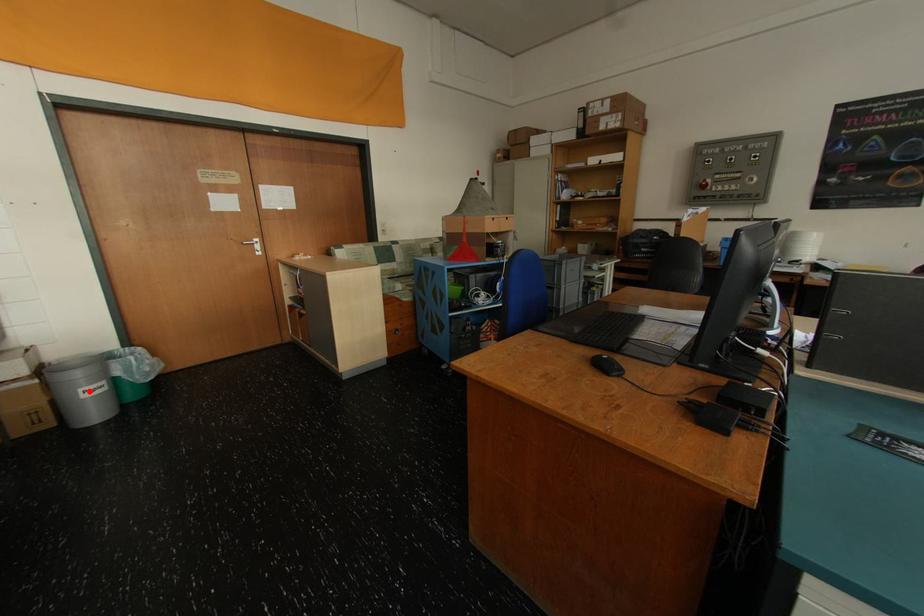
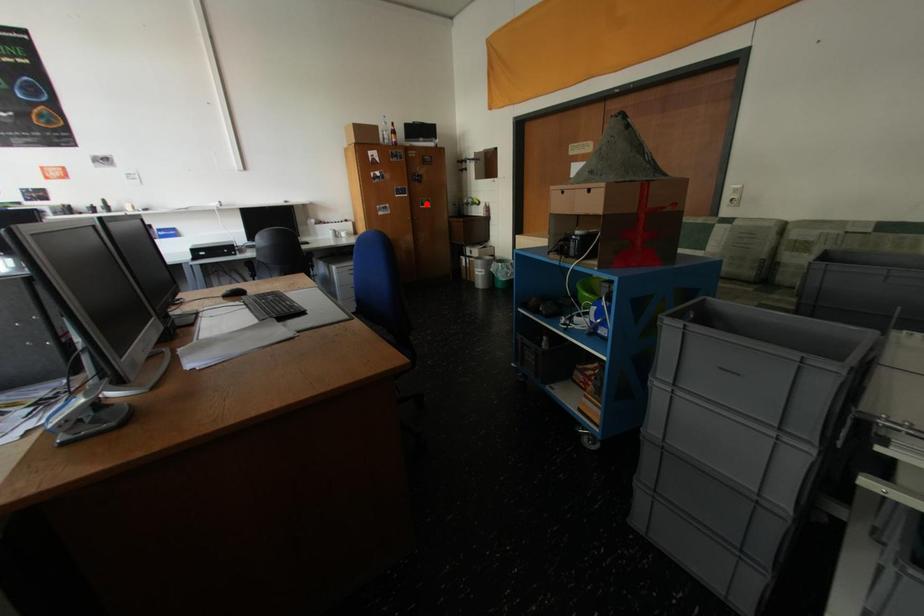
I am providing you with two images of the same scene from different viewpoints. A red point is marked on the first image and another point is marked on the second image. Is the marked point in image1 the same physical position as the marked point in image2?

No